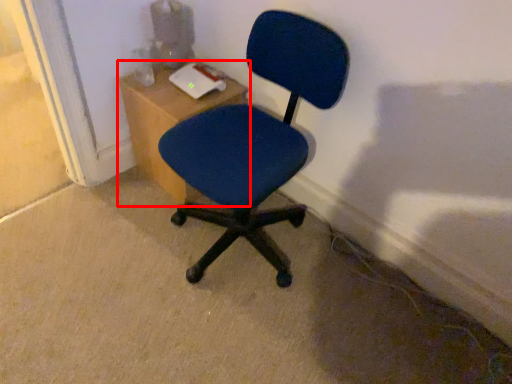
Question: In this image, where is table (annotated by the red box) located relative to chair?

Choices:
 (A) left
 (B) right

Answer: (A)